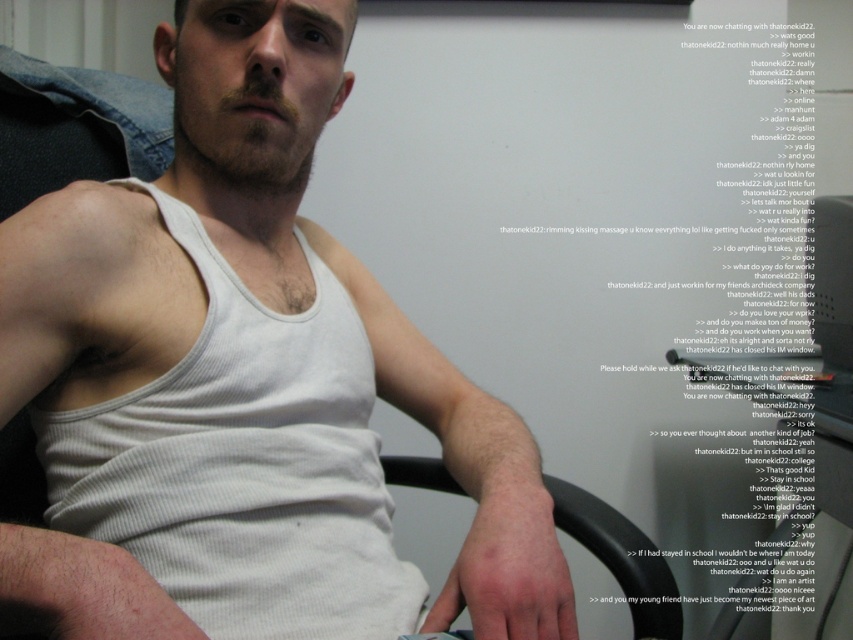
You are a fashion designer observing the scene. You need to determine the spatial relationship between the white ribbed tank top at center and the black plastic chair at lower center. Which object is positioned higher in the image?

The white ribbed tank top at center is located above the black plastic chair at lower center, so it is positioned higher in the image.

You are an interior designer planning to place a new decorative item between the white ribbed tank top at center and the black plastic chair at lower center. According to the scene description, which object should the decorative item be placed closer to?

The decorative item should be placed closer to the black plastic chair at lower center because the white ribbed tank top at center is positioned on the left side of the black plastic chair at lower center, meaning the chair is to the right of the tank top. Therefore, placing the decorative item closer to the chair would maintain the existing spatial arrangement.